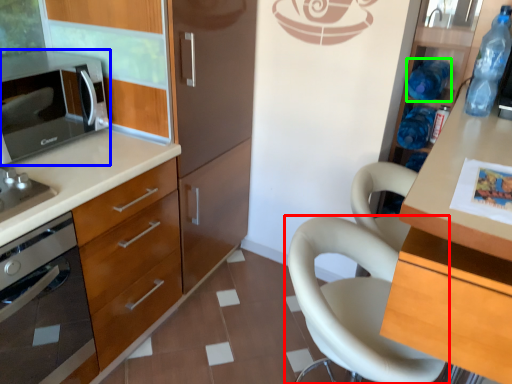
Question: Which object is the closest to the chair (highlighted by a red box)? Choose among these: microwave oven (highlighted by a blue box) or bottle (highlighted by a green box).

Choices:
 (A) microwave oven
 (B) bottle

Answer: (B)